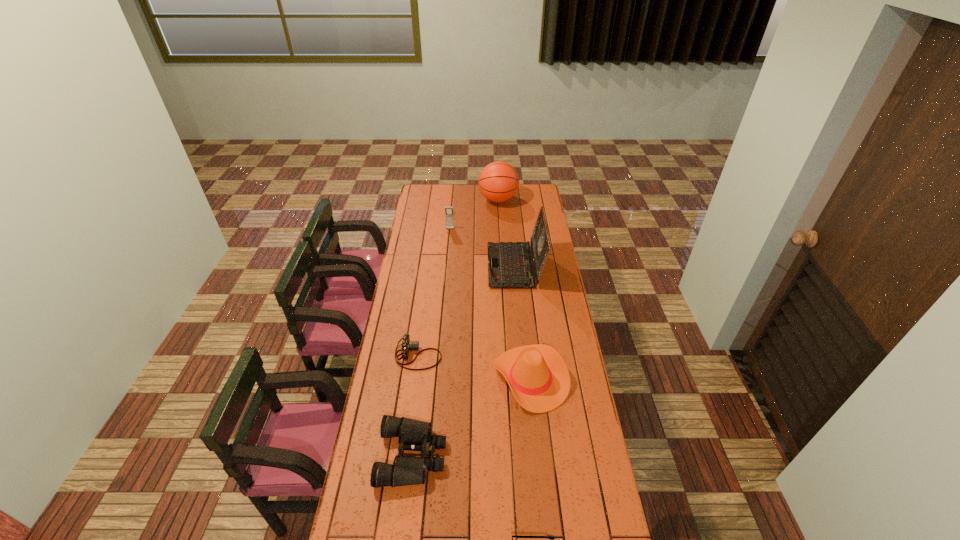
Identify the location of free spot between the sixth tallest object and the fifth nearest object. (467, 310).

The image size is (960, 540). What are the coordinates of `blank region between the sixth farthest object and the farthest object` in the screenshot? It's located at (x=455, y=328).

Choose which object is the fourth nearest neighbor to the cowboy hat. Please provide its 2D coordinates. Your answer should be formatted as a tuple, i.e. [(x, y)], where the tuple contains the x and y coordinates of a point satisfying the conditions above.

[(551, 539)]

Where is `object that is the second nearest to the fifth tallest object`? object that is the second nearest to the fifth tallest object is located at coordinates (407, 345).

The height and width of the screenshot is (540, 960). I want to click on free spot that satisfies the following two spatial constraints: 1. on the front-facing side of the cellular telephone; 2. on the front-facing side of the camera, so click(x=439, y=355).

Where is `vacant point that satisfies the following two spatial constraints: 1. on the front-facing side of the second farthest object; 2. on the front-facing side of the camera`? This screenshot has width=960, height=540. vacant point that satisfies the following two spatial constraints: 1. on the front-facing side of the second farthest object; 2. on the front-facing side of the camera is located at coordinates (439, 355).

At what (x,y) coordinates should I click in order to perform the action: click on free space that satisfies the following two spatial constraints: 1. on the front-facing side of the sixth tallest object; 2. on the right side of the cowboy hat. Please return your answer as a coordinate pair (x, y). Image resolution: width=960 pixels, height=540 pixels. Looking at the image, I should click on (415, 378).

This screenshot has width=960, height=540. In order to click on free location that satisfies the following two spatial constraints: 1. on the front side of the farthest object; 2. on the front-facing side of the second shortest object in this screenshot , I will do point(508,355).

Find the location of a particular element. This screenshot has width=960, height=540. vacant area in the image that satisfies the following two spatial constraints: 1. on the front-facing side of the cowboy hat; 2. on the right side of the second shortest object is located at coordinates (415, 378).